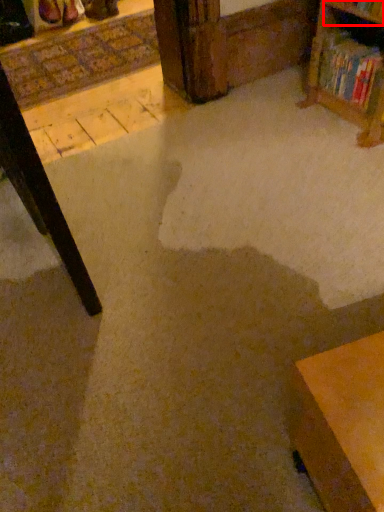
Question: In this image, where is shelf (annotated by the red box) located relative to book?

Choices:
 (A) left
 (B) right

Answer: (A)